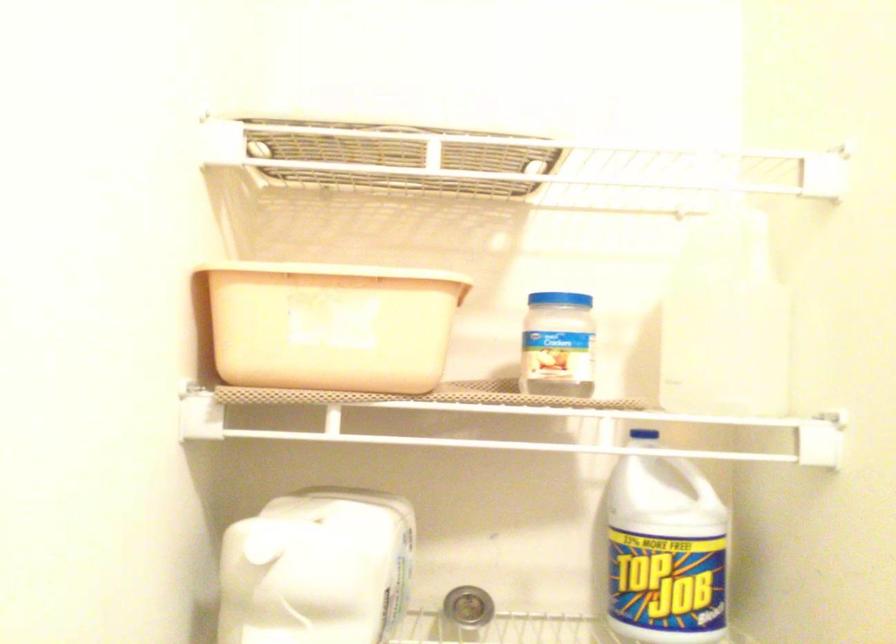
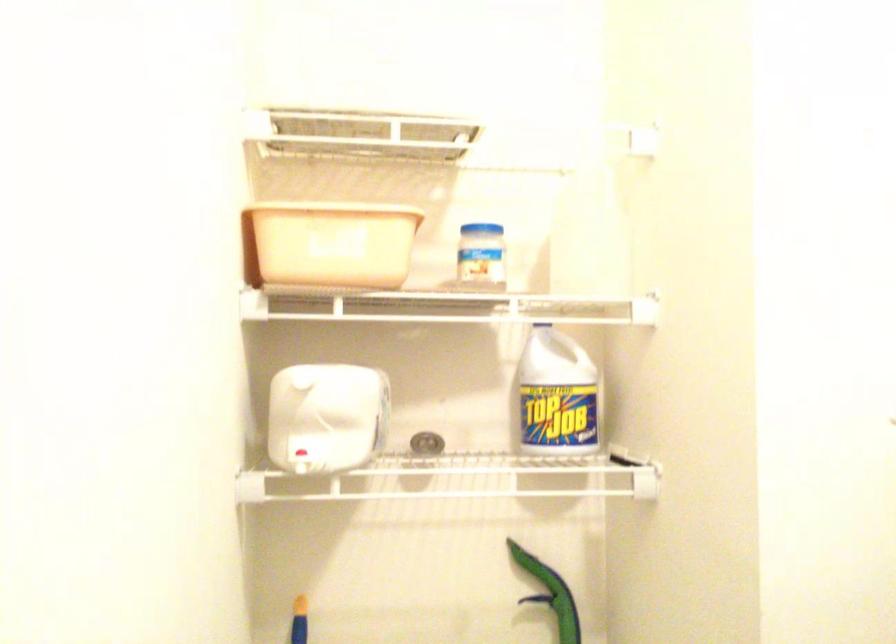
Find the pixel in the second image that matches (558,298) in the first image.

(479, 225)